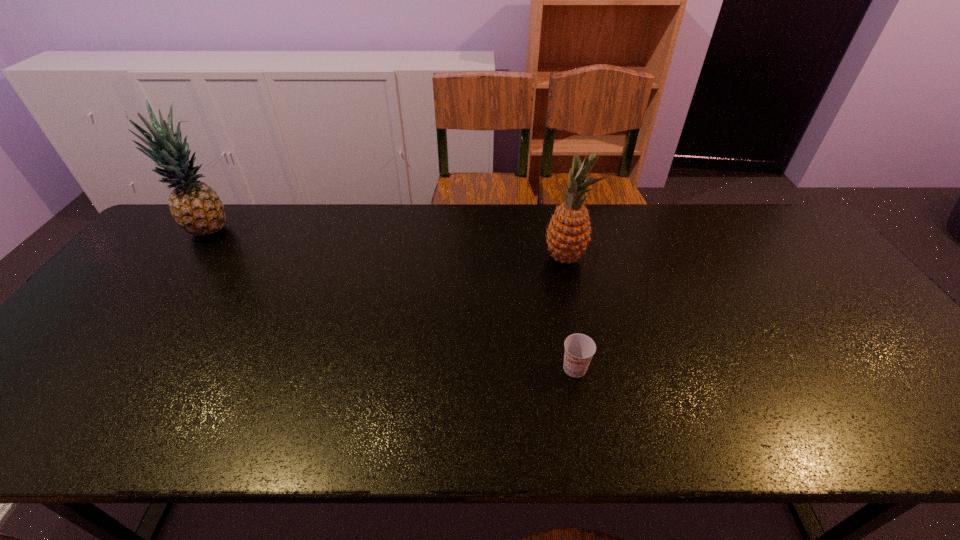
Identify the location of object at the far left corner. The width and height of the screenshot is (960, 540). (195, 206).

Find the location of `vacant region at the far edge`. vacant region at the far edge is located at coordinates (594, 209).

In the image, there is a desktop. At what (x,y) coordinates should I click in order to perform the action: click on vacant space at the near edge. Please return your answer as a coordinate pair (x, y). The image size is (960, 540). Looking at the image, I should click on (828, 427).

You are a GUI agent. You are given a task and a screenshot of the screen. Output one action in this format:
    pyautogui.click(x=<x>, y=<y>)
    Task: Click on the vacant space at the right edge of the desktop
    The height and width of the screenshot is (540, 960).
    Given the screenshot: What is the action you would take?
    pyautogui.click(x=908, y=377)

I want to click on vacant area at the far right corner, so click(729, 205).

Image resolution: width=960 pixels, height=540 pixels. Find the location of `empty space between the taller pineapple and the second shortest object`. empty space between the taller pineapple and the second shortest object is located at coordinates (388, 245).

Find the location of a particular element. The height and width of the screenshot is (540, 960). vacant area that lies between the second tallest object and the left pineapple is located at coordinates pos(388,245).

You are a GUI agent. You are given a task and a screenshot of the screen. Output one action in this format:
    pyautogui.click(x=<x>, y=<y>)
    Task: Click on the vacant area between the left pineapple and the nearest object
    
    Given the screenshot: What is the action you would take?
    pyautogui.click(x=393, y=300)

Locate an element on the screen. This screenshot has width=960, height=540. blank region between the left pineapple and the Dixie cup is located at coordinates (393, 300).

You are a GUI agent. You are given a task and a screenshot of the screen. Output one action in this format:
    pyautogui.click(x=<x>, y=<y>)
    Task: Click on the vacant point located between the taller pineapple and the right pineapple
    The image size is (960, 540).
    Given the screenshot: What is the action you would take?
    pyautogui.click(x=388, y=245)